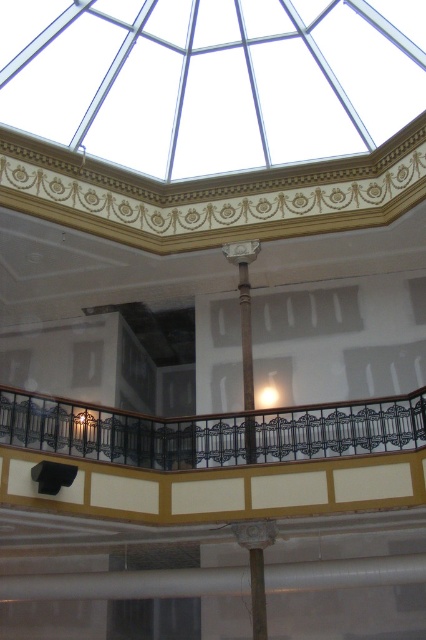
Question: Considering the relative positions of black wrought iron balcony at center and matte gray column at center in the image provided, where is black wrought iron balcony at center located with respect to matte gray column at center?

Choices:
 (A) right
 (B) left

Answer: (B)

Question: Can you confirm if black wrought iron balcony at center is positioned above matte gray column at center?

Choices:
 (A) yes
 (B) no

Answer: (A)

Question: Among these objects, which one is farthest from the camera?

Choices:
 (A) black wrought iron balcony at center
 (B) matte gray column at center

Answer: (B)

Question: Which object appears closest to the camera in this image?

Choices:
 (A) matte gray column at center
 (B) black wrought iron balcony at center

Answer: (B)

Question: Which point is farther from the camera taking this photo?

Choices:
 (A) (137, 456)
 (B) (256, 556)

Answer: (A)

Question: Is black wrought iron balcony at center bigger than matte gray column at center?

Choices:
 (A) no
 (B) yes

Answer: (B)